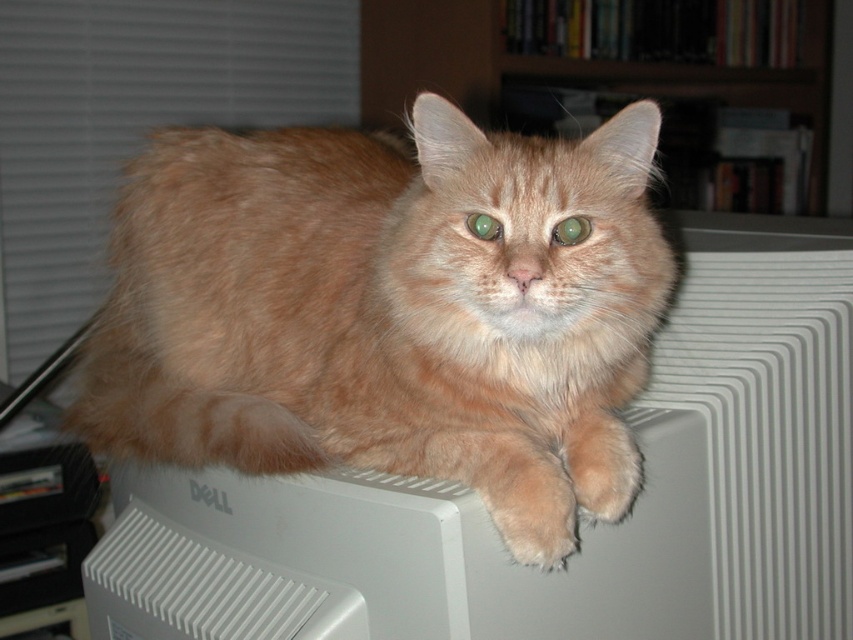
Is fuzzy orange cat at center smaller than wooden bookshelf at upper center?

Correct, fuzzy orange cat at center occupies less space than wooden bookshelf at upper center.

Does fuzzy orange cat at center have a larger size compared to wooden bookshelf at upper center?

No.

Image resolution: width=853 pixels, height=640 pixels. Identify the location of fuzzy orange cat at center. (389, 310).